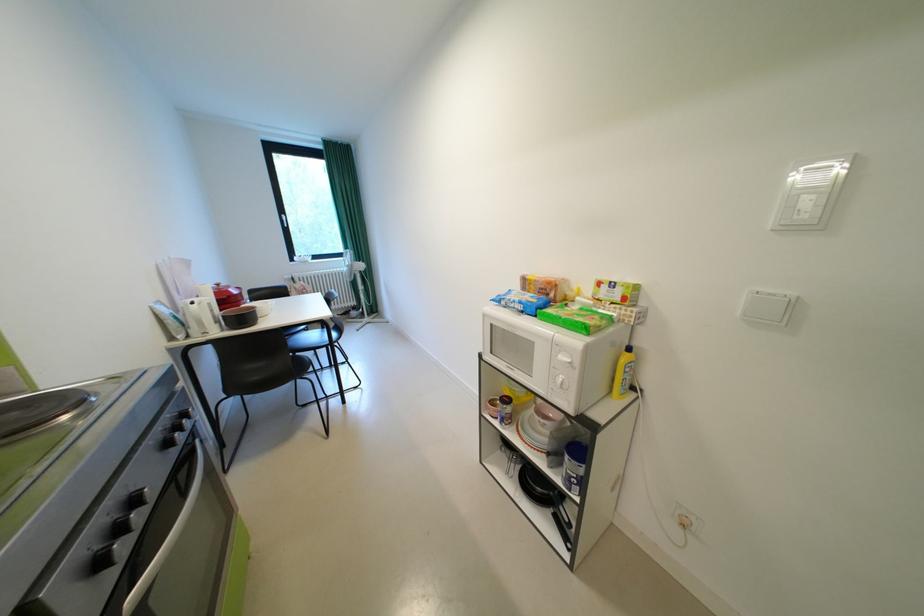
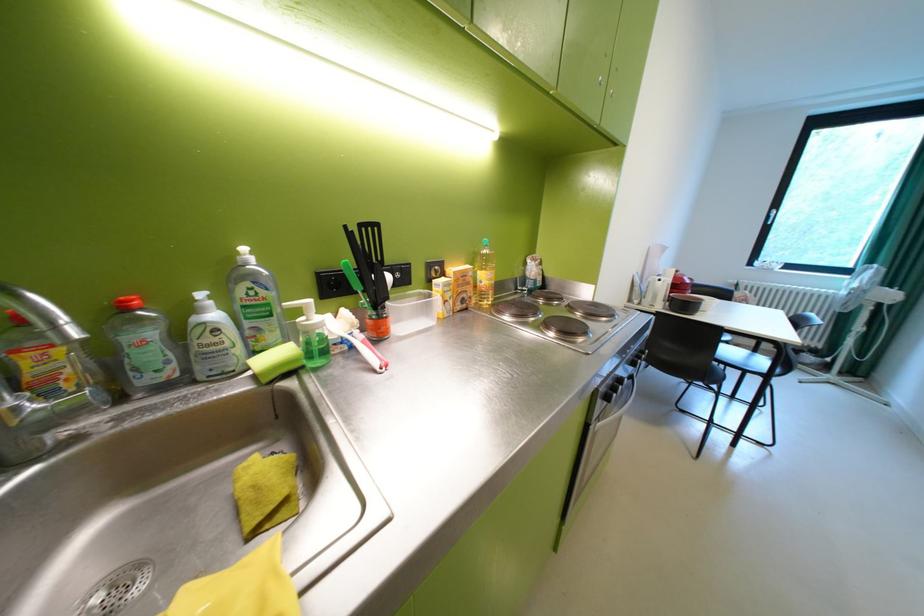
First-person continuous shooting, in which direction is the camera rotating?

The rotation direction of the camera is left-down.